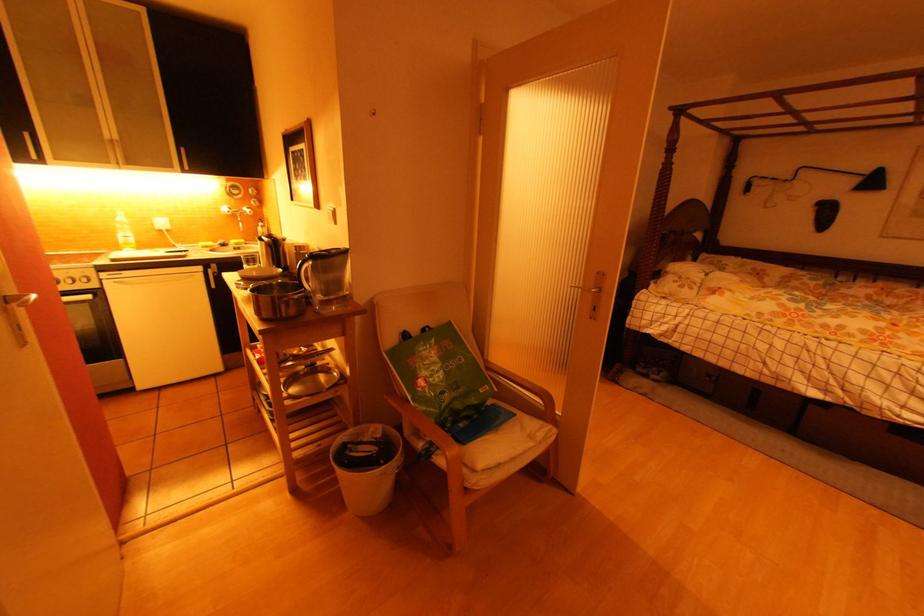
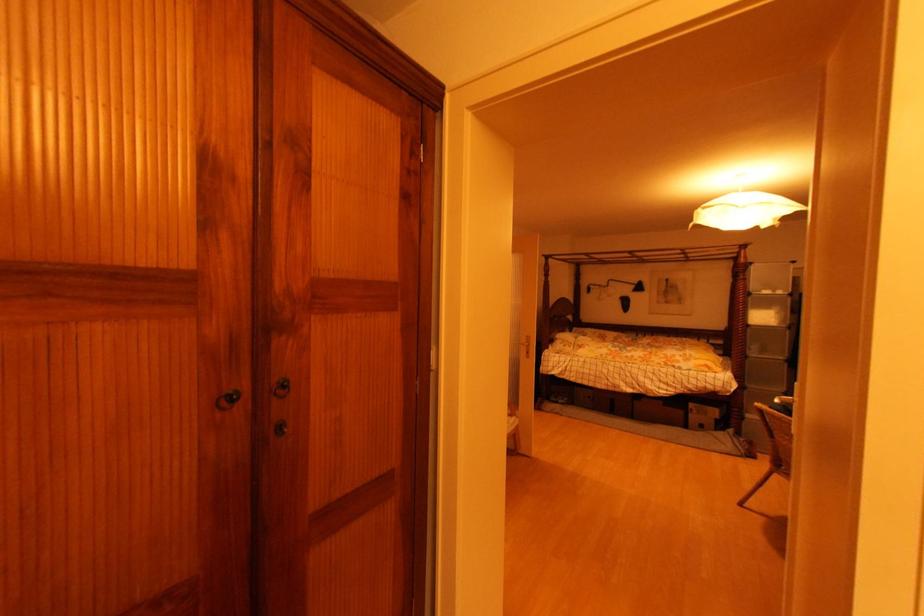
Locate, in the second image, the point that corresponds to the point at 860,182 in the first image.

(638, 288)